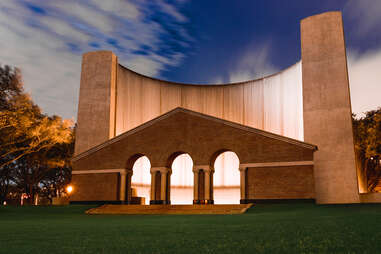
Identify the location of box. The height and width of the screenshot is (254, 381). (134, 197), (136, 202).